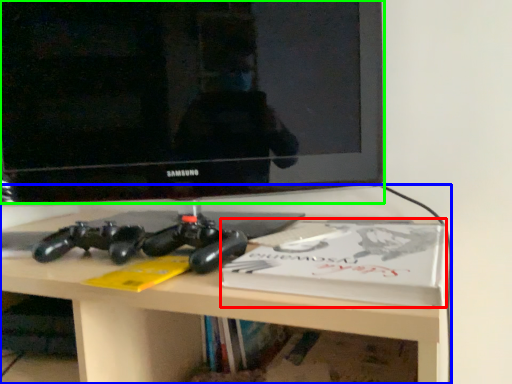
Question: Considering the real-world distances, which object is farthest from paperback book (highlighted by a red box)? desk (highlighted by a blue box) or television (highlighted by a green box)?

Choices:
 (A) desk
 (B) television

Answer: (B)